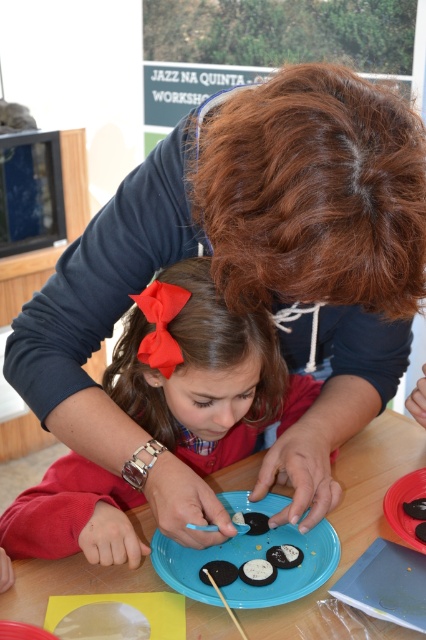
You are setting up a small snack area on the wooden table at center. You have a blue matte plate at center that needs to be placed on the table. Considering the table and plate sizes, will the plate fit entirely on the table?

The wooden table at center is wider than the blue matte plate at center, so the plate will fit entirely on the table.

You are standing at the edge of the room and want to place a small toy on the wooden table at center without touching the blue matte plate at center. Is this possible?

The wooden table at center is above the blue matte plate at center, so placing the toy on the table would not interfere with the plate since it is elevated above it.

You are a photographer wanting to capture a closeup of the matte red bow at center without the wooden table at center appearing in the background. Is the current setup possible?

The wooden table at center is behind the matte red bow at center, so the photographer can position themselves so that the matte red bow at center is in the foreground and the wooden table at center is out of frame, making it possible to capture the closeup without the table appearing in the background.